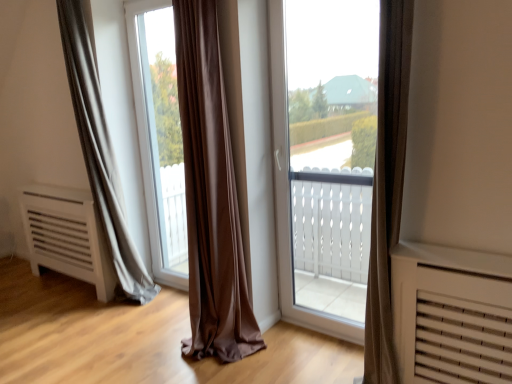
Question: Is transparent glass window at center completely or partially outside of matte gray curtain at left?

Choices:
 (A) yes
 (B) no

Answer: (A)

Question: Is transparent glass window at center to the left of matte gray curtain at left from the viewer's perspective?

Choices:
 (A) yes
 (B) no

Answer: (B)

Question: Considering the relative sizes of transparent glass window at center and matte gray curtain at left in the image provided, is transparent glass window at center shorter than matte gray curtain at left?

Choices:
 (A) yes
 (B) no

Answer: (A)

Question: Would you say transparent glass window at center contains matte gray curtain at left?

Choices:
 (A) no
 (B) yes

Answer: (A)

Question: Is transparent glass window at center in contact with matte gray curtain at left?

Choices:
 (A) no
 (B) yes

Answer: (A)

Question: Considering the relative sizes of transparent glass window at center and matte gray curtain at left in the image provided, is transparent glass window at center wider than matte gray curtain at left?

Choices:
 (A) no
 (B) yes

Answer: (A)

Question: Considering the relative sizes of transparent glass window at center and transparent glass window at center in the image provided, is transparent glass window at center smaller than transparent glass window at center?

Choices:
 (A) no
 (B) yes

Answer: (A)

Question: Is transparent glass window at center placed right next to transparent glass window at center?

Choices:
 (A) yes
 (B) no

Answer: (B)

Question: From a real-world perspective, is transparent glass window at center physically below transparent glass window at center?

Choices:
 (A) no
 (B) yes

Answer: (B)

Question: Is transparent glass window at center to the left of transparent glass window at center from the viewer's perspective?

Choices:
 (A) no
 (B) yes

Answer: (A)

Question: Could transparent glass window at center be considered to be inside transparent glass window at center?

Choices:
 (A) yes
 (B) no

Answer: (B)

Question: From the image's perspective, is transparent glass window at center under transparent glass window at center?

Choices:
 (A) no
 (B) yes

Answer: (B)

Question: From the image's perspective, is matte gray curtain at left below transparent glass window at center?

Choices:
 (A) yes
 (B) no

Answer: (B)